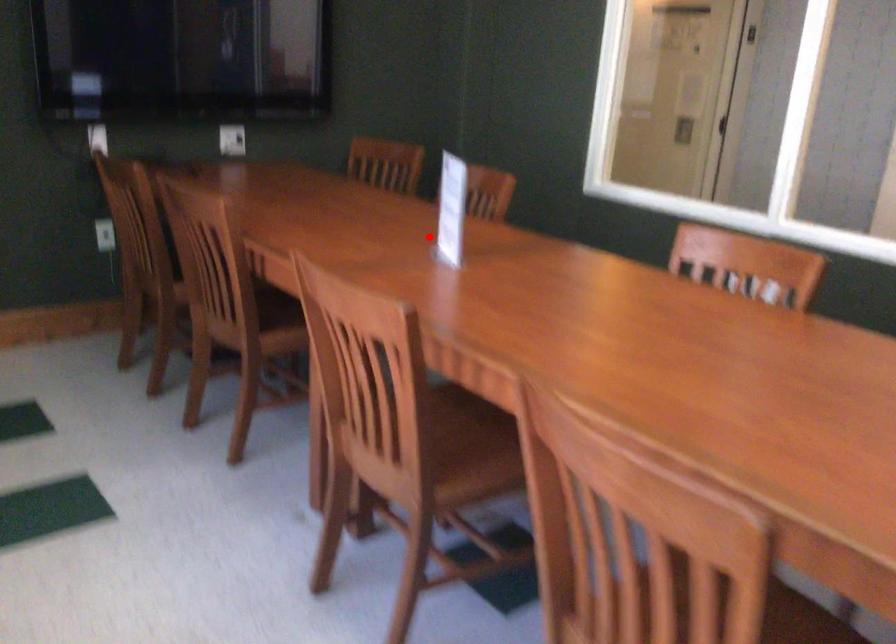
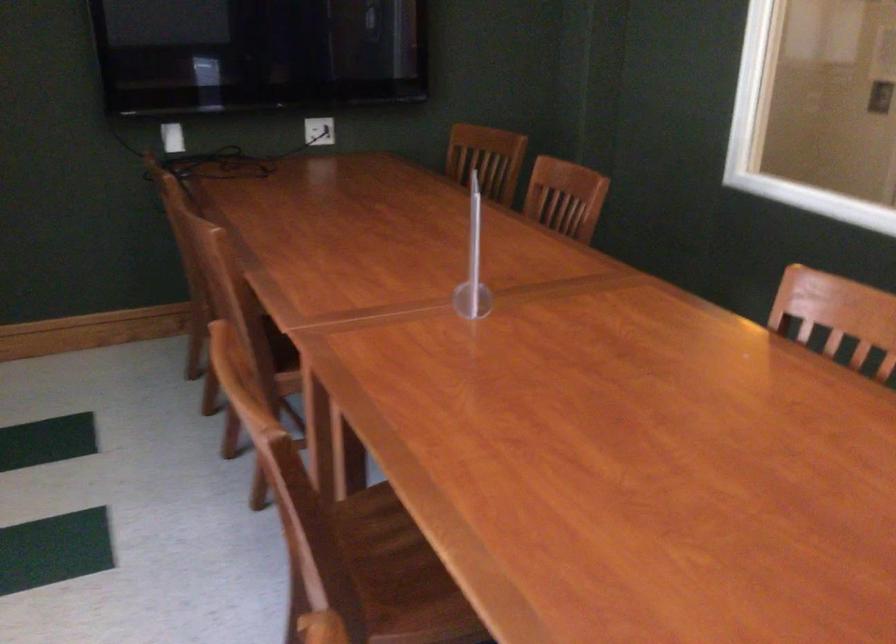
In the second image, find the point that corresponds to the highlighted location in the first image.

(472, 263)